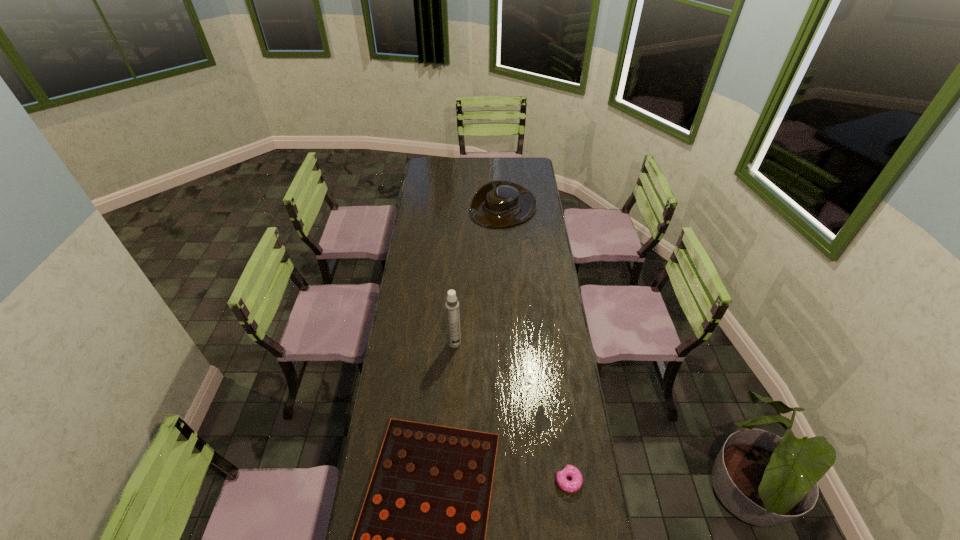
At what (x,y) coordinates should I click in order to perform the action: click on aerosol can. Please return your answer as a coordinate pair (x, y). The height and width of the screenshot is (540, 960). Looking at the image, I should click on point(452,305).

I want to click on the third nearest object, so click(x=452, y=305).

Locate an element on the screen. This screenshot has width=960, height=540. the farthest object is located at coordinates (497, 204).

Locate an element on the screen. the second tallest object is located at coordinates (497, 204).

At what (x,y) coordinates should I click in order to perform the action: click on the shortest object. Please return your answer as a coordinate pair (x, y). Looking at the image, I should click on (575, 484).

You are a GUI agent. You are given a task and a screenshot of the screen. Output one action in this format:
    pyautogui.click(x=<x>, y=<y>)
    Task: Click on the free region located on the right of the second farthest object
    This screenshot has width=960, height=540.
    Given the screenshot: What is the action you would take?
    pyautogui.click(x=502, y=343)

This screenshot has width=960, height=540. In order to click on vacant area located on the back of the third shortest object in this screenshot , I will do `click(501, 158)`.

Where is `free location located 0.220m on the back of the shortest object`? The height and width of the screenshot is (540, 960). free location located 0.220m on the back of the shortest object is located at coordinates (558, 407).

You are a GUI agent. You are given a task and a screenshot of the screen. Output one action in this format:
    pyautogui.click(x=<x>, y=<y>)
    Task: Click on the cowboy hat present at the right edge
    This screenshot has height=540, width=960.
    Given the screenshot: What is the action you would take?
    pos(497,204)

The width and height of the screenshot is (960, 540). I want to click on doughnut that is at the right edge, so click(x=575, y=484).